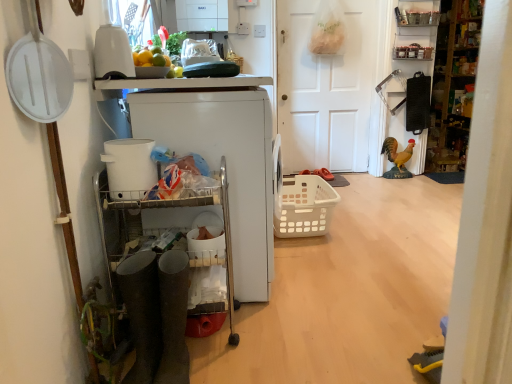
You are a GUI agent. You are given a task and a screenshot of the screen. Output one action in this format:
    pyautogui.click(x=<x>, y=<y>)
    Task: Click on the free region on the left part of yellow matte rooster at right
    
    Given the screenshot: What is the action you would take?
    pyautogui.click(x=372, y=178)